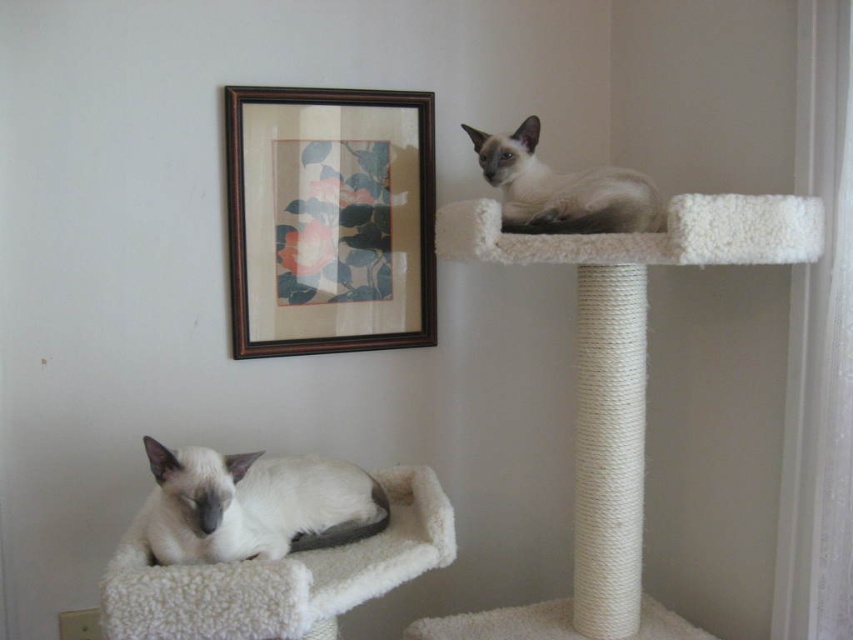
You are a cat owner who wants to place a small toy on the cat tree so that it is equidistant from both cats. Given the coordinates of the white soft cat at lower left at point 0.789, 0.297, where should you place the toy?

To place the toy equidistant from both cats, you would need the coordinates of both cats. However, the position of the second cat is not provided in the Objects Description. Please provide the coordinates of the second cat to calculate the midpoint.

You are a cat owner who wants to place a small toy on the cat tree so both cats can easily reach it. The toy requires a flat surface that is at least 1.5 meters away from the camera to ensure it stays within the cat tree area. Is the point at coordinates point (297, 252) suitable for placing the toy?

The point at coordinates point (297, 252) is 1.62 meters away from the camera, which meets the requirement of being at least 1.5 meters away. Therefore, the point at coordinates point (297, 252) is suitable for placing the toy.

You are a cat owner who wants to place a small toy between the white soft cat at lower left and the satin fur cat at upper right. Considering their sizes, which cat will the toy be closer to when placed exactly halfway between them?

The toy will be closer to the satin fur cat at upper right because the white soft cat at lower left is wider than the satin fur cat at upper right, making the midpoint closer to the smaller cat.